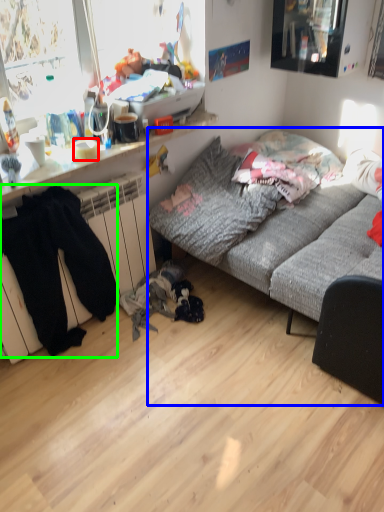
Question: Which is nearer to the bowl (highlighted by a red box)? studio couch (highlighted by a blue box) or clothing (highlighted by a green box).

Choices:
 (A) studio couch
 (B) clothing

Answer: (B)